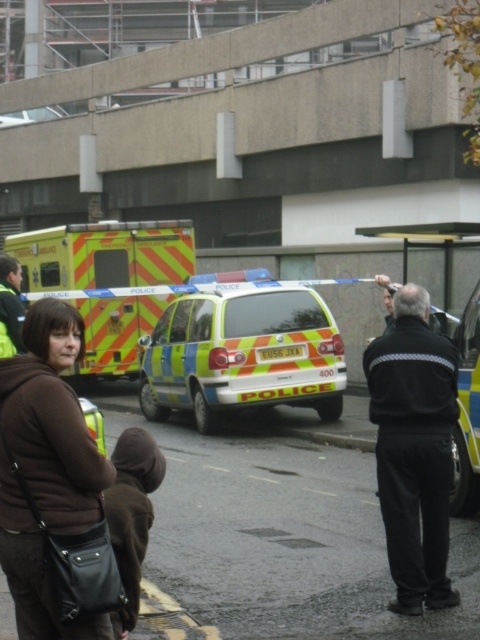
You are a photographer trying to capture the scene of the emergency services. You notice two points in the image, one at coordinate point (x=33, y=461) and the other at point (x=148, y=356). Which point will appear larger in your photo?

Point (x=33, y=461) is closer to the camera than point (x=148, y=356), so it will appear larger in the photo.

You are a pedestrian standing at the edge of the construction site. You see the black smooth jacket at center and the yellow reflective van at center. Which object is closer to you?

The black smooth jacket at center is closer to you because it is in front of the yellow reflective van at center.

You are a pedestrian standing at the edge of the construction site. You see the brown fabric jacket at lower left and the reflective yellow and blue van at center. Which object is narrower in width?

The brown fabric jacket at lower left is thinner than the reflective yellow and blue van at center, so the brown fabric jacket at lower left is narrower in width.